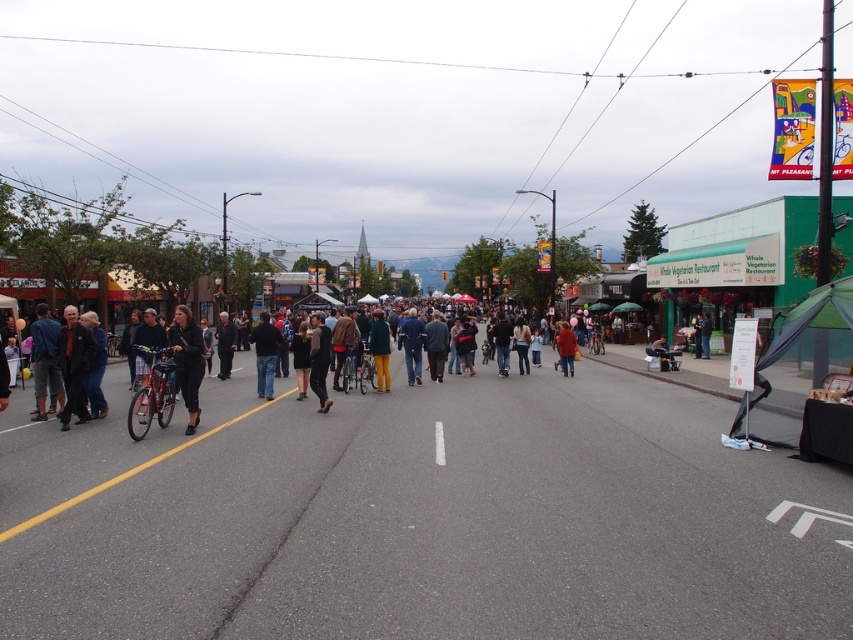
Who is positioned more to the right, denim jacket at center or dark gray jacket at center?

denim jacket at center

Can you confirm if denim jacket at center is bigger than dark gray jacket at center?

Yes.

Locate an element on the screen. This screenshot has width=853, height=640. denim jacket at center is located at coordinates coord(412,346).

Find the location of `denim jacket at center`. denim jacket at center is located at coordinates (412, 346).

Does dark gray jacket at left have a larger size compared to dark brown leather jacket at center?

No, dark gray jacket at left is not bigger than dark brown leather jacket at center.

Does dark gray jacket at left lie in front of dark brown leather jacket at center?

That is True.

Identify the location of dark gray jacket at left. The height and width of the screenshot is (640, 853). (74, 364).

Who is taller, green fabric jacket at center or dark gray jacket at center?

With more height is green fabric jacket at center.

Who is more distant from viewer, [379,376] or [230,365]?

The point [230,365] is behind.

I want to click on green fabric jacket at center, so click(x=380, y=349).